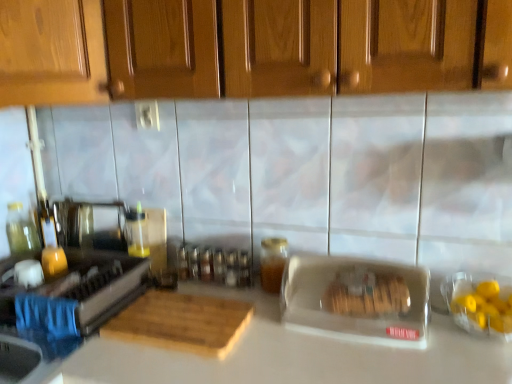
Question: Would you say wooden cutting board at center is part of clear plastic container at center, the 2th appliance positioned from the left,'s contents?

Choices:
 (A) yes
 (B) no

Answer: (B)

Question: Is clear plastic container at center, the 2th appliance positioned from the left, directly adjacent to wooden cutting board at center?

Choices:
 (A) no
 (B) yes

Answer: (A)

Question: Does clear plastic container at center, the 2th appliance positioned from the left, appear on the right side of wooden cutting board at center?

Choices:
 (A) yes
 (B) no

Answer: (A)

Question: Is clear plastic container at center, acting as the first appliance starting from the right, outside of wooden cutting board at center?

Choices:
 (A) yes
 (B) no

Answer: (A)

Question: Is clear plastic container at center, the 2th appliance positioned from the left, bigger than wooden cutting board at center?

Choices:
 (A) no
 (B) yes

Answer: (B)

Question: Is clear plastic container at center, acting as the first appliance starting from the right, positioned in front of wooden cutting board at center?

Choices:
 (A) no
 (B) yes

Answer: (B)

Question: From the image's perspective, is wooden cutting board at center above white matte countertop at center?

Choices:
 (A) yes
 (B) no

Answer: (A)

Question: From the image's perspective, is wooden cutting board at center below white matte countertop at center?

Choices:
 (A) no
 (B) yes

Answer: (A)

Question: Does wooden cutting board at center have a lesser width compared to white matte countertop at center?

Choices:
 (A) yes
 (B) no

Answer: (A)

Question: Does wooden cutting board at center have a greater width compared to white matte countertop at center?

Choices:
 (A) yes
 (B) no

Answer: (B)

Question: Considering the relative sizes of wooden cutting board at center and white matte countertop at center in the image provided, is wooden cutting board at center taller than white matte countertop at center?

Choices:
 (A) no
 (B) yes

Answer: (A)

Question: Is white matte countertop at center a part of wooden cutting board at center?

Choices:
 (A) no
 (B) yes

Answer: (A)

Question: Is wooden cabinet at upper center not within white matte countertop at center?

Choices:
 (A) no
 (B) yes

Answer: (B)